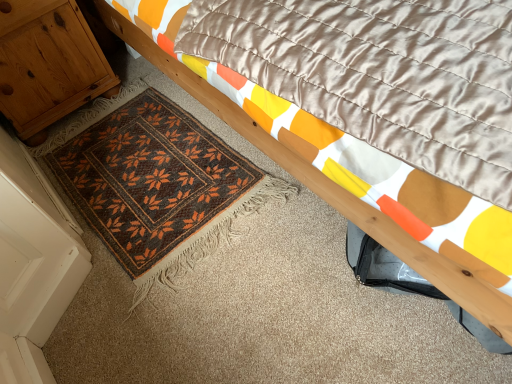
Question: From the image's perspective, relative to wooden bed frame at upper right, is wooden cabinet at left above or below?

Choices:
 (A) below
 (B) above

Answer: (B)

Question: From a real-world perspective, relative to wooden bed frame at upper right, is wooden cabinet at left vertically above or below?

Choices:
 (A) above
 (B) below

Answer: (B)

Question: Which object is the closest to the brown woven mat at lower left?

Choices:
 (A) wooden bed frame at upper right
 (B) wooden cabinet at left

Answer: (B)

Question: Which is nearer to the wooden bed frame at upper right?

Choices:
 (A) brown woven mat at lower left
 (B) wooden cabinet at left

Answer: (A)